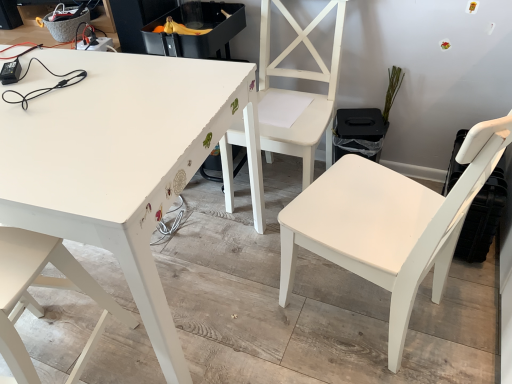
This screenshot has width=512, height=384. Find the location of `free space that is to the left of white matte chair at center, arranged as the 3th chair when viewed from the left`. free space that is to the left of white matte chair at center, arranged as the 3th chair when viewed from the left is located at coordinates (265, 321).